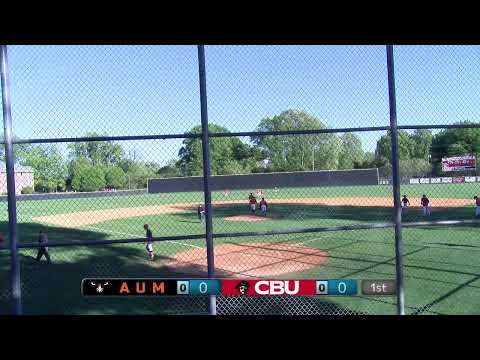
You are a GUI agent. You are given a task and a screenshot of the screen. Output one action in this format:
    pyautogui.click(x=<x>, y=<y>)
    Task: Click on the central wall in background
    
    Given the screenshot: What is the action you would take?
    pyautogui.click(x=316, y=183)